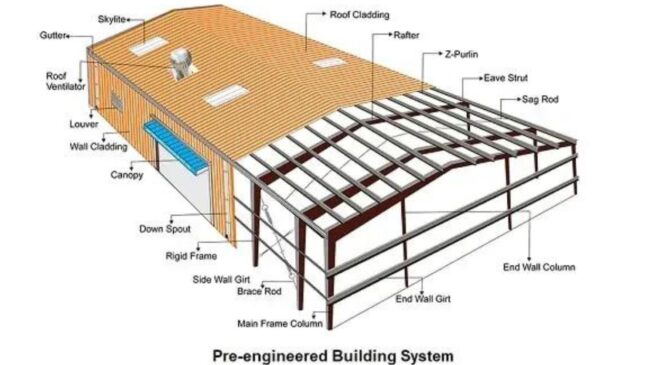
Where is `corner`? This screenshot has width=650, height=365. corner is located at coordinates (330, 285).